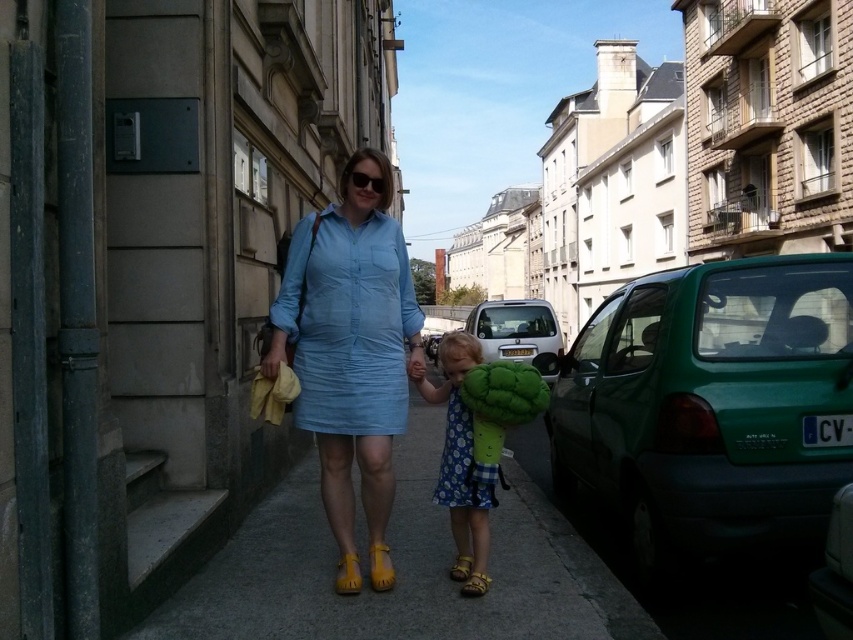
Who is higher up, light blue cotton dress at center or white matte car at center?

light blue cotton dress at center is above.

Is light blue cotton dress at center positioned before white matte car at center?

Yes, it is.

At what (x,y) coordinates should I click in order to perform the action: click on light blue cotton dress at center. Please return your answer as a coordinate pair (x, y). The height and width of the screenshot is (640, 853). Looking at the image, I should click on (347, 323).

I want to click on light blue cotton dress at center, so click(347, 323).

Who is higher up, matte blue dress at center or white matte car at center?

matte blue dress at center

Measure the distance between point (312, 221) and camera.

The distance of point (312, 221) from camera is 10.68 feet.

Does point (273, 307) come behind point (477, 337)?

No.

I want to click on matte blue dress at center, so click(x=351, y=353).

Looking at this image, does matte blue dress at center appear under floral cotton dress at center?

Actually, matte blue dress at center is above floral cotton dress at center.

Consider the image. Who is higher up, matte blue dress at center or floral cotton dress at center?

matte blue dress at center

This screenshot has height=640, width=853. What do you see at coordinates (351, 353) in the screenshot?
I see `matte blue dress at center` at bounding box center [351, 353].

You are a GUI agent. You are given a task and a screenshot of the screen. Output one action in this format:
    pyautogui.click(x=<x>, y=<y>)
    Task: Click on the matte blue dress at center
    
    Given the screenshot: What is the action you would take?
    [351, 353]